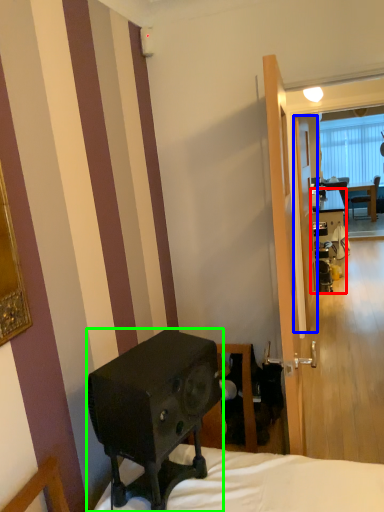
Question: Considering the real-world distances, which object is farthest from desk (highlighted by a red box)? screen door (highlighted by a blue box) or loudspeaker (highlighted by a green box)?

Choices:
 (A) screen door
 (B) loudspeaker

Answer: (B)